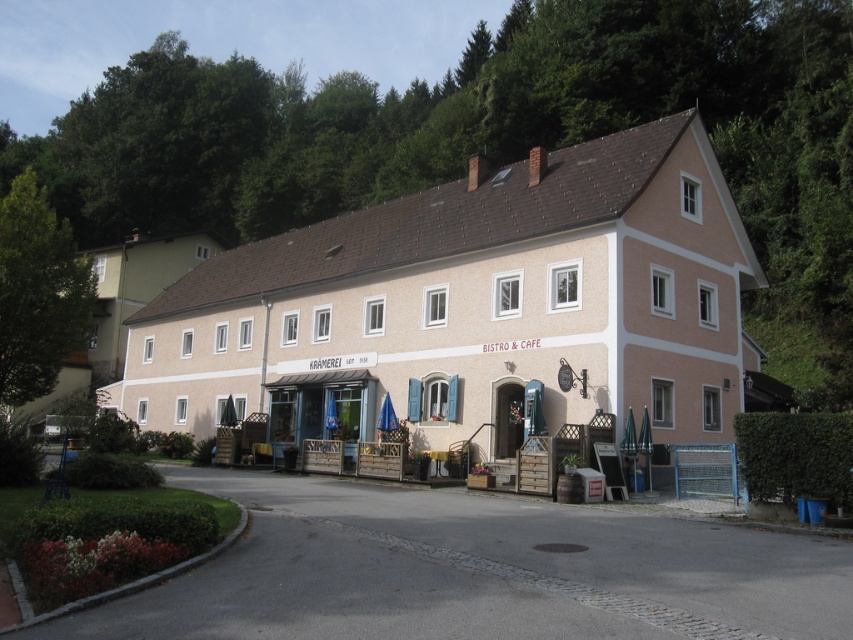
Question: Is light pink stucco building at center below white painted wood building at lower left?

Choices:
 (A) yes
 (B) no

Answer: (A)

Question: Is the position of light pink stucco building at center less distant than that of white painted wood building at lower left?

Choices:
 (A) no
 (B) yes

Answer: (B)

Question: Among these objects, which one is farthest from the camera?

Choices:
 (A) white painted wood building at lower left
 (B) light pink stucco building at center

Answer: (A)

Question: Is light pink stucco building at center positioned in front of white painted wood building at lower left?

Choices:
 (A) no
 (B) yes

Answer: (B)

Question: Which object is closer to the camera taking this photo?

Choices:
 (A) white painted wood building at lower left
 (B) light pink stucco building at center

Answer: (B)